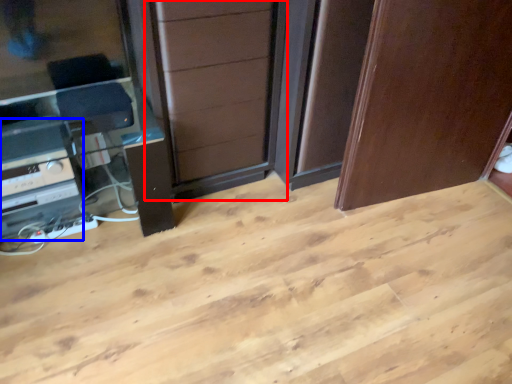
Question: Among these objects, which one is nearest to the camera, screen door (highlighted by a red box) or appliance (highlighted by a blue box)?

Choices:
 (A) screen door
 (B) appliance

Answer: (A)